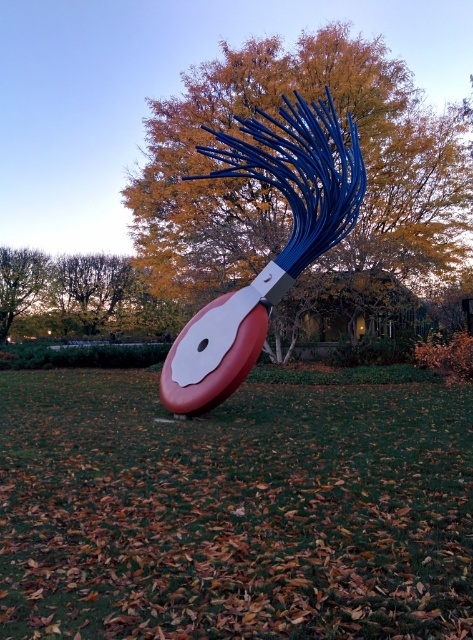
In the scene shown: You are standing in the park and want to take a photo of the sculpture. The camera you have can focus on objects up to 10 meters away. Is the point at coordinates point (351, 195) within the camera focus range?

The distance of point (351, 195) from the camera is 9.30 meters, which is within the camera focus range of up to 10 meters. Therefore, the point can be focused on by the camera.

You are an artist preparing to paint the sculpture. You have a limited amount of green paint and want to know if the green grass at center will require more paint than the metallic blue brush at center. Based on their sizes, which object would need more paint?

The metallic blue brush at center is larger in size than the green grass at center, so it would require more paint.